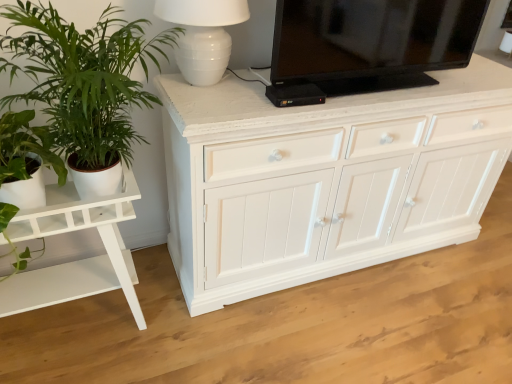
Question: From a real-world perspective, is white ceramic lamp at upper center on green leafy plant at left?

Choices:
 (A) yes
 (B) no

Answer: (A)

Question: Does white ceramic lamp at upper center appear on the left side of green leafy plant at left?

Choices:
 (A) yes
 (B) no

Answer: (B)

Question: Does white ceramic lamp at upper center have a greater width compared to green leafy plant at left?

Choices:
 (A) yes
 (B) no

Answer: (B)

Question: Could green leafy plant at left be considered to be inside white ceramic lamp at upper center?

Choices:
 (A) yes
 (B) no

Answer: (B)

Question: Considering the relative sizes of white ceramic lamp at upper center and green leafy plant at left in the image provided, is white ceramic lamp at upper center smaller than green leafy plant at left?

Choices:
 (A) yes
 (B) no

Answer: (A)

Question: Considering the relative sizes of white ceramic lamp at upper center and green leafy plant at left in the image provided, is white ceramic lamp at upper center taller than green leafy plant at left?

Choices:
 (A) no
 (B) yes

Answer: (A)

Question: Considering the relative sizes of white glossy table at left and green leafy plant at left in the image provided, is white glossy table at left thinner than green leafy plant at left?

Choices:
 (A) no
 (B) yes

Answer: (B)

Question: Is white glossy table at left facing away from green leafy plant at left?

Choices:
 (A) yes
 (B) no

Answer: (B)

Question: Is white glossy table at left with green leafy plant at left?

Choices:
 (A) no
 (B) yes

Answer: (A)

Question: Does white glossy table at left have a larger size compared to green leafy plant at left?

Choices:
 (A) yes
 (B) no

Answer: (A)

Question: Does white glossy table at left appear on the left side of green leafy plant at left?

Choices:
 (A) yes
 (B) no

Answer: (A)

Question: From the image's perspective, is white glossy table at left under green leafy plant at left?

Choices:
 (A) no
 (B) yes

Answer: (B)

Question: Is green leafy plant at left closer to camera compared to white ceramic lamp at upper center?

Choices:
 (A) no
 (B) yes

Answer: (B)